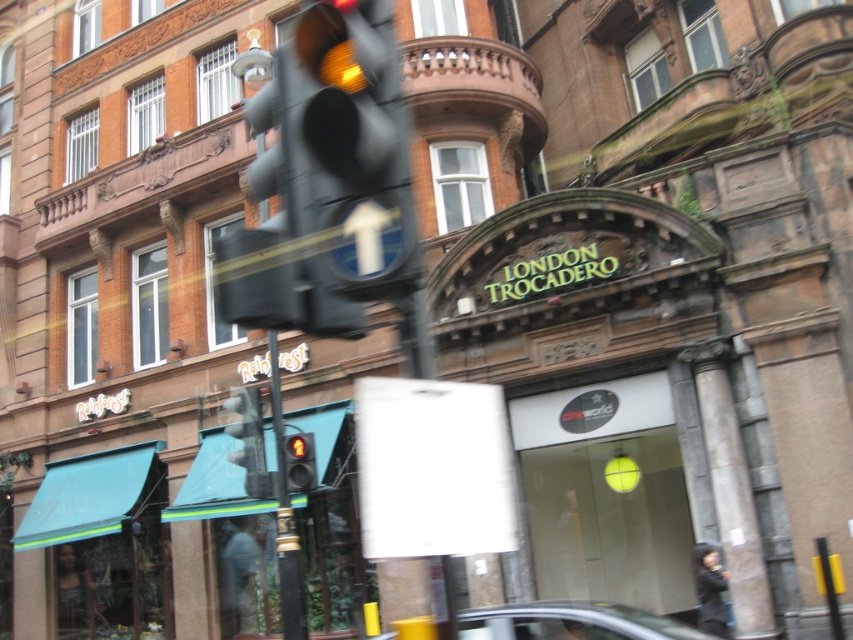
You are a pedestrian standing at the crosswalk and want to cross the street. You see a metallic silver car at lower center and a metallic traffic light at center. Which object is closer to you?

The metallic silver car at lower center is closer to you because it is in front of the metallic traffic light at center.

You are standing at the entrance of the historic building and want to park your metallic silver car at lower center. What is the exact 2D coordinate where you should position your car?

The metallic silver car at lower center should be positioned at the exact 2D coordinate point of [572,621].

You are a delivery person who needs to park your delivery van, which is 2 meters tall, near the entrance of the building. The entrance has large glass doors with a bright yellow light. There is a metallic silver car at lower center and a metallic pole at center. Can you safely park your van between them without hitting the pole?

The metallic silver car at lower center is not as tall as the metallic pole at center. Since your van is 2 meters tall, you need to ensure there is enough vertical clearance. However, the description only mentions the height comparison between the car and the pole, not the actual height of the pole. Without knowing the pole height, it is uncertain if the van can pass safely.